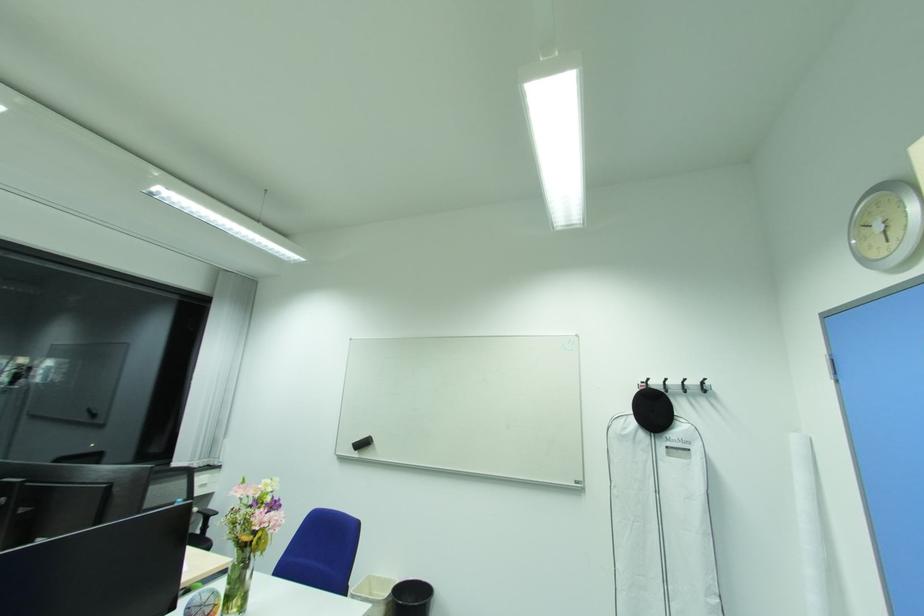
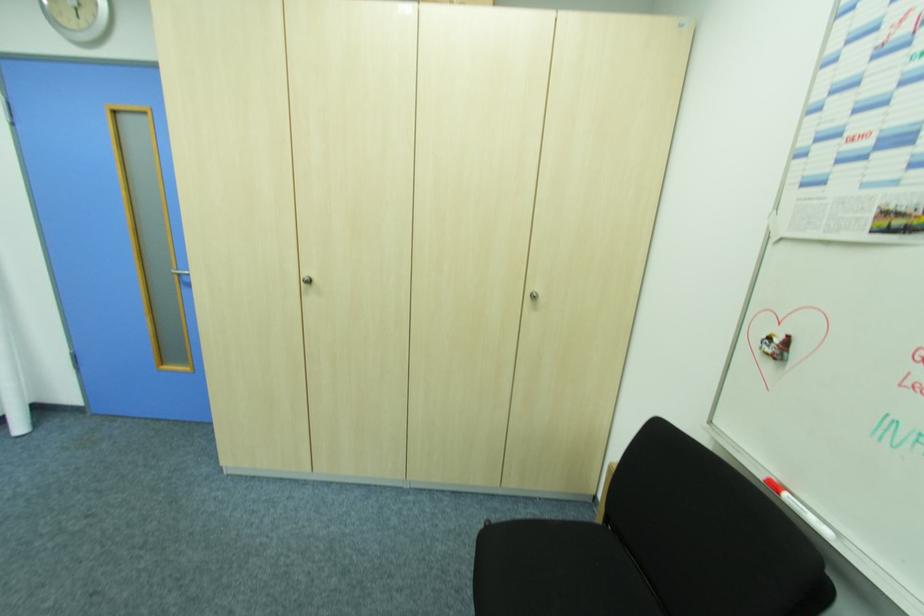
Question: The images are taken continuously from a first-person perspective. In which direction is your viewpoint rotating?

Choices:
 (A) Left
 (B) Right
 (C) Up
 (D) Down

Answer: (B)